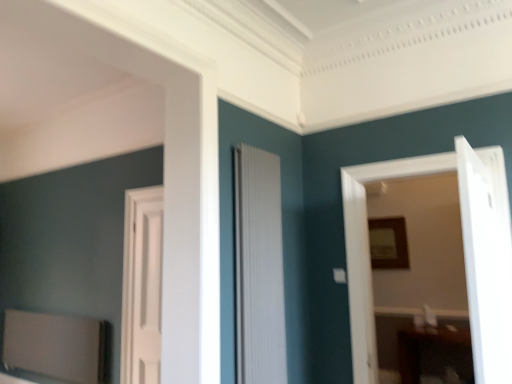
Question: Based on their sizes in the image, would you say wooden frame at upper right is bigger or smaller than white glossy door at right, marked as the first door in a right-to-left arrangement?

Choices:
 (A) small
 (B) big

Answer: (A)

Question: Considering their positions, is wooden frame at upper right located in front of or behind white glossy door at right, arranged as the fourth door when viewed from the left?

Choices:
 (A) front
 (B) behind

Answer: (B)

Question: Estimate the real-world distances between objects in this image. Which object is closer to the white matte door at center, the 4th door positioned from the right?

Choices:
 (A) white wooden door at center, which is counted as the second door, starting from the right
 (B) white glossy door at right, arranged as the fourth door when viewed from the left
 (C) wooden frame at upper right
 (D) white ribbed radiator at center, the 2th door when ordered from left to right

Answer: (D)

Question: Estimate the real-world distances between objects in this image. Which object is farther from the white matte door at center, the 4th door positioned from the right?

Choices:
 (A) white ribbed radiator at center, arranged as the 3th door when viewed from the right
 (B) white wooden door at center, which is the 3th door in left-to-right order
 (C) wooden frame at upper right
 (D) white glossy door at right, arranged as the fourth door when viewed from the left

Answer: (D)